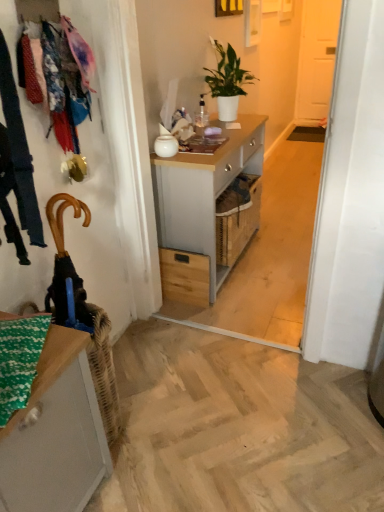
Where is `free spot above light gray wood desk at center (from a real-world perspective)`? This screenshot has height=512, width=384. free spot above light gray wood desk at center (from a real-world perspective) is located at coordinates (221, 133).